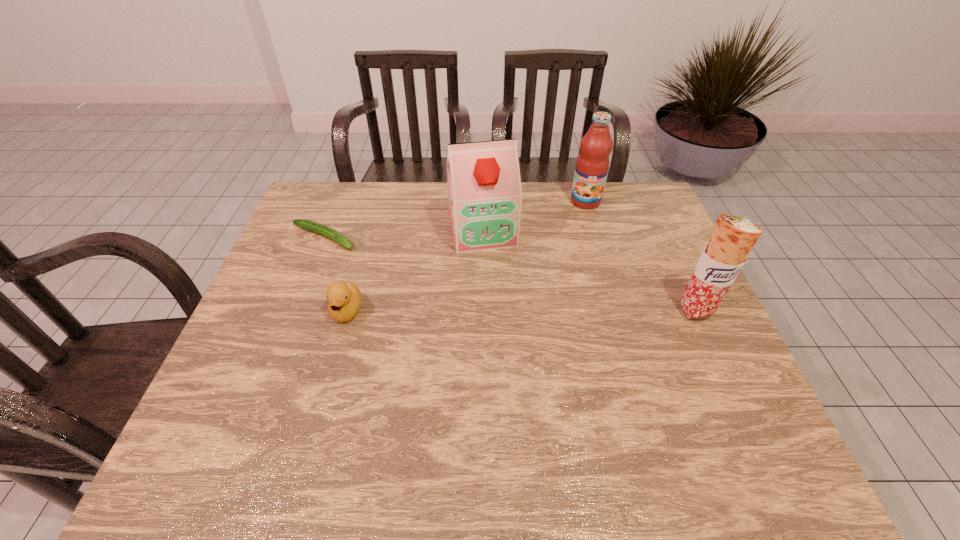
The width and height of the screenshot is (960, 540). Identify the location of the fourth tallest object. (344, 298).

Where is `the rightmost object`? the rightmost object is located at coordinates (733, 237).

I want to click on the third object from right to left, so click(485, 194).

At what (x,y) coordinates should I click in order to perform the action: click on zucchini. Please return your answer as a coordinate pair (x, y). Looking at the image, I should click on (309, 225).

Locate an element on the screen. This screenshot has width=960, height=540. the fourth object from left to right is located at coordinates (592, 165).

Find the location of a particular element. vacant area situated 0.110m facing forward on the duckling is located at coordinates coord(331,367).

Identify the location of vacant space located on the back of the burrito. The width and height of the screenshot is (960, 540). (677, 268).

Locate an element on the screen. vacant space situated with the cap open on the soya milk is located at coordinates (517, 360).

Image resolution: width=960 pixels, height=540 pixels. Identify the location of vacant point located with the cap open on the soya milk. (514, 347).

You are a GUI agent. You are given a task and a screenshot of the screen. Output one action in this format:
    pyautogui.click(x=<x>, y=<y>)
    Task: Click on the free space located with the cap open on the soya milk
    
    Given the screenshot: What is the action you would take?
    pyautogui.click(x=512, y=336)